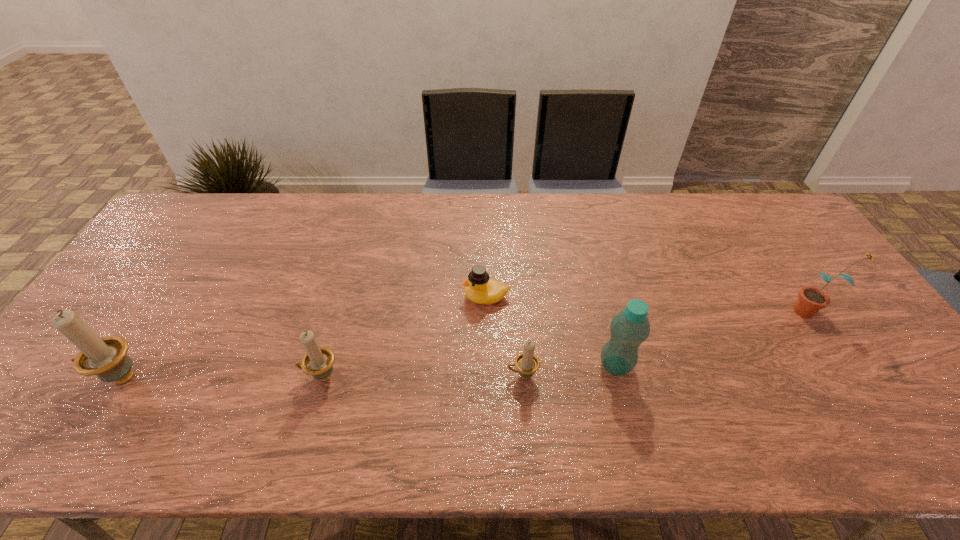
Where is `free space located at the front cap of the water bottle`? free space located at the front cap of the water bottle is located at coordinates (578, 366).

Locate an element on the screen. This screenshot has width=960, height=540. free space located at the front cap of the water bottle is located at coordinates (466, 366).

Where is `free spot located on the front-facing side of the duck`? This screenshot has width=960, height=540. free spot located on the front-facing side of the duck is located at coordinates (347, 297).

Identify the location of blank space located on the front-facing side of the duck. This screenshot has width=960, height=540. (323, 297).

The height and width of the screenshot is (540, 960). I want to click on vacant space located on the front-facing side of the duck, so click(417, 297).

Locate an element on the screen. water bottle at the near edge is located at coordinates (630, 328).

Identify the location of object at the left edge. (106, 357).

Find the location of a particular element. This screenshot has height=540, width=960. object situated at the right edge is located at coordinates (811, 299).

Where is `object positioned at the near left corner`? Image resolution: width=960 pixels, height=540 pixels. object positioned at the near left corner is located at coordinates (106, 357).

Image resolution: width=960 pixels, height=540 pixels. In the image, there is a desktop. What are the coordinates of `free space at the far edge` in the screenshot? It's located at (380, 225).